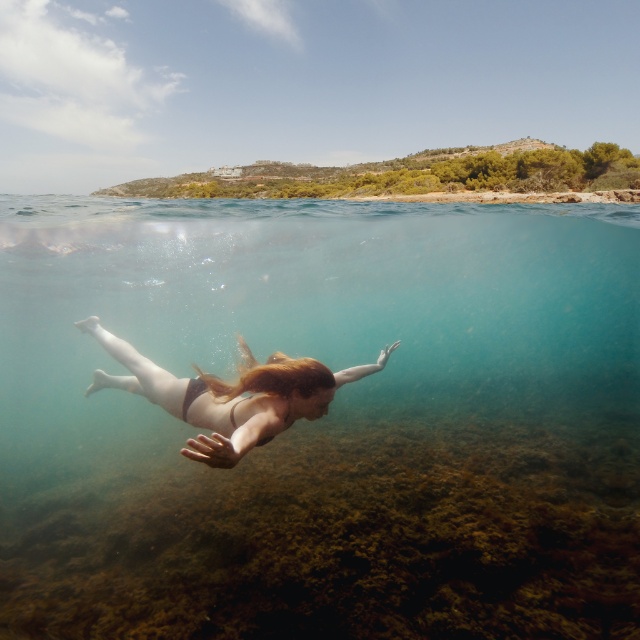
Can you confirm if clear blue water at center is positioned to the left of smooth skin girl at center?

Incorrect, clear blue water at center is not on the left side of smooth skin girl at center.

Can you confirm if clear blue water at center is shorter than smooth skin girl at center?

Incorrect, clear blue water at center's height does not fall short of smooth skin girl at center's.

Locate an element on the screen. Image resolution: width=640 pixels, height=640 pixels. clear blue water at center is located at coordinates (324, 420).

Find the location of a particular element. The image size is (640, 640). clear blue water at center is located at coordinates (324, 420).

Which of these two, clear blue water at center or blonde silky hair at center, stands taller?

clear blue water at center

Does clear blue water at center appear under blonde silky hair at center?

Indeed, clear blue water at center is positioned under blonde silky hair at center.

Between point (45, 371) and point (276, 364), which one is positioned in front?

Positioned in front is point (276, 364).

Where is `clear blue water at center`? The width and height of the screenshot is (640, 640). clear blue water at center is located at coordinates (324, 420).

Between point (278, 394) and point (284, 369), which one is positioned behind?

Positioned behind is point (284, 369).

Does smooth skin girl at center have a lesser height compared to blonde silky hair at center?

Incorrect, smooth skin girl at center's height does not fall short of blonde silky hair at center's.

Locate an element on the screen. Image resolution: width=640 pixels, height=640 pixels. smooth skin girl at center is located at coordinates (262, 403).

You are a GUI agent. You are given a task and a screenshot of the screen. Output one action in this format:
    pyautogui.click(x=<x>, y=<y>)
    Task: Click on the smooth skin girl at center
    
    Given the screenshot: What is the action you would take?
    pyautogui.click(x=262, y=403)